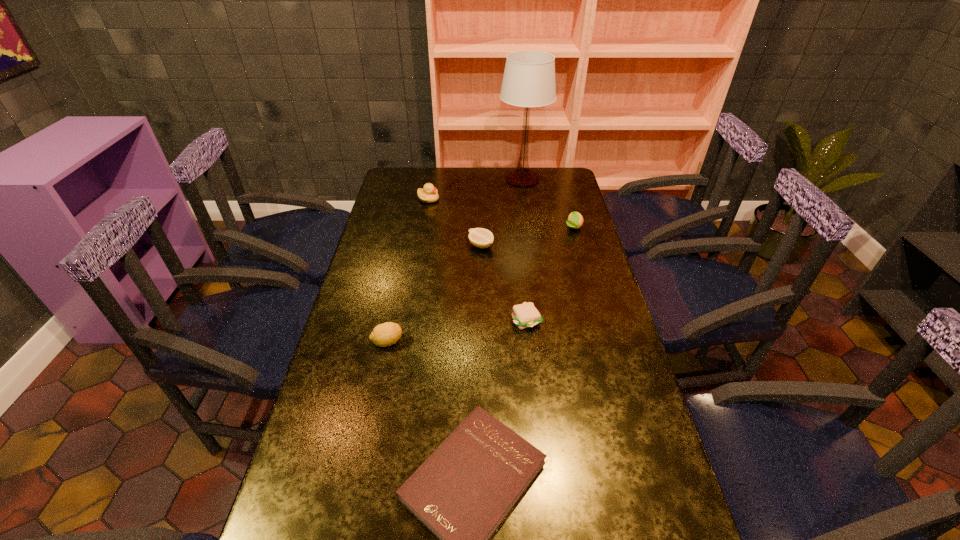
Image resolution: width=960 pixels, height=540 pixels. I want to click on the tallest object, so click(x=529, y=77).

Where is `the farthest object`? the farthest object is located at coordinates (529, 77).

Find the location of a particular element. the sixth nearest object is located at coordinates (429, 194).

Locate an element on the screen. This screenshot has height=540, width=960. the farthest lemon is located at coordinates (575, 220).

Locate an element on the screen. The image size is (960, 540). the rightmost object is located at coordinates pyautogui.click(x=575, y=220).

Where is `the second nearest object`? This screenshot has width=960, height=540. the second nearest object is located at coordinates (383, 335).

At what (x,y) coordinates should I click in order to perform the action: click on the nearest lemon. Please return your answer as a coordinate pair (x, y). The height and width of the screenshot is (540, 960). Looking at the image, I should click on (383, 335).

The height and width of the screenshot is (540, 960). Find the location of `the shortest lemon`. the shortest lemon is located at coordinates (482, 238).

Find the location of `the second lemon from left to right`. the second lemon from left to right is located at coordinates (482, 238).

Identify the location of patty. The height and width of the screenshot is (540, 960). (525, 315).